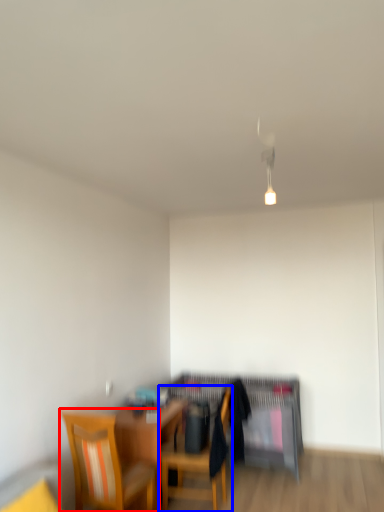
Question: Which object appears farthest to the camera in this image, chair (highlighted by a red box) or chair (highlighted by a blue box)?

Choices:
 (A) chair
 (B) chair

Answer: (B)